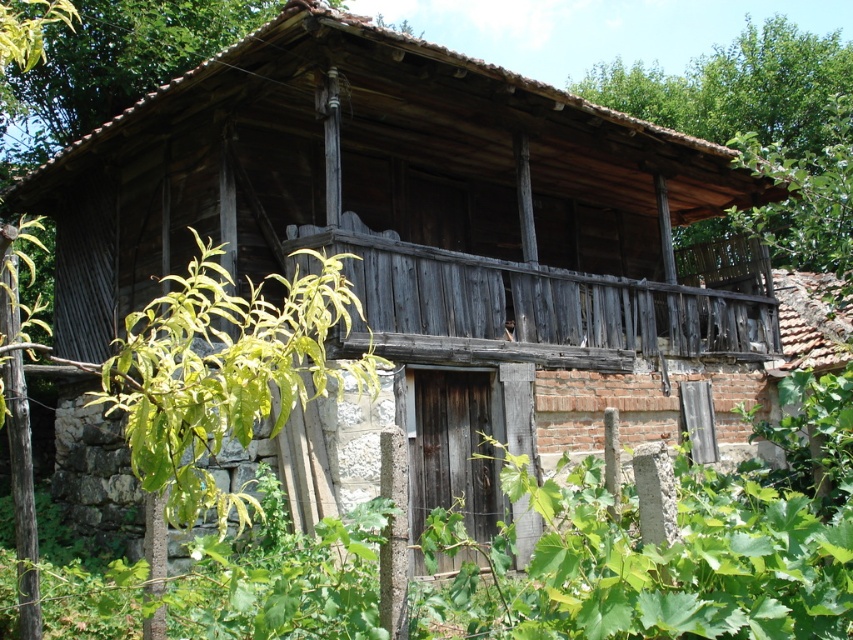
You are standing in front of the old wooden structure and see a green leafy plant at center and a green leafy tree at upper right. Which one is closer to you?

The green leafy plant at center is closer to you than the green leafy tree at upper right.

You are standing at the entrance of the old wooden structure and want to place a small potted plant in the center of the balcony. Is the green leafy plant at center already occupying that spot?

The green leafy plant at center is located at point coordinates of (676, 552), so yes, it is already occupying the center of the balcony.

You are a gardener planning to place a new shrub that requires a space of 1 meter in width. You see the green leafy plant at center and the green leafy tree at upper right in the scene. Which one currently occupies a space that is suitable for the shrub?

The green leafy tree at upper right has a width greater than the green leafy plant at center, so the green leafy tree at upper right is suitable for the shrub since its width is more than 1 meter.